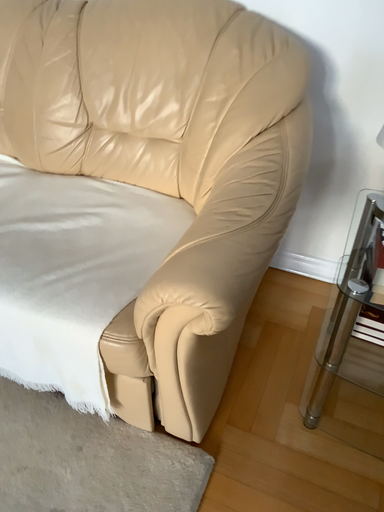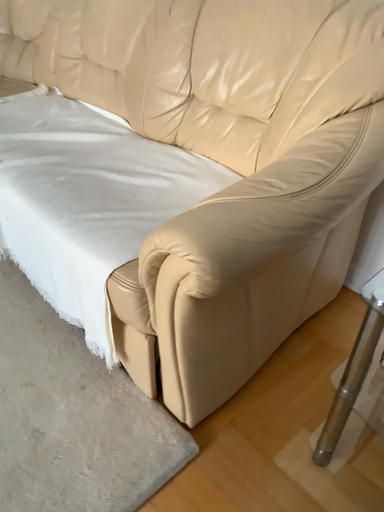
Question: How did the camera likely rotate when shooting the video?

Choices:
 (A) rotated left
 (B) rotated right

Answer: (A)